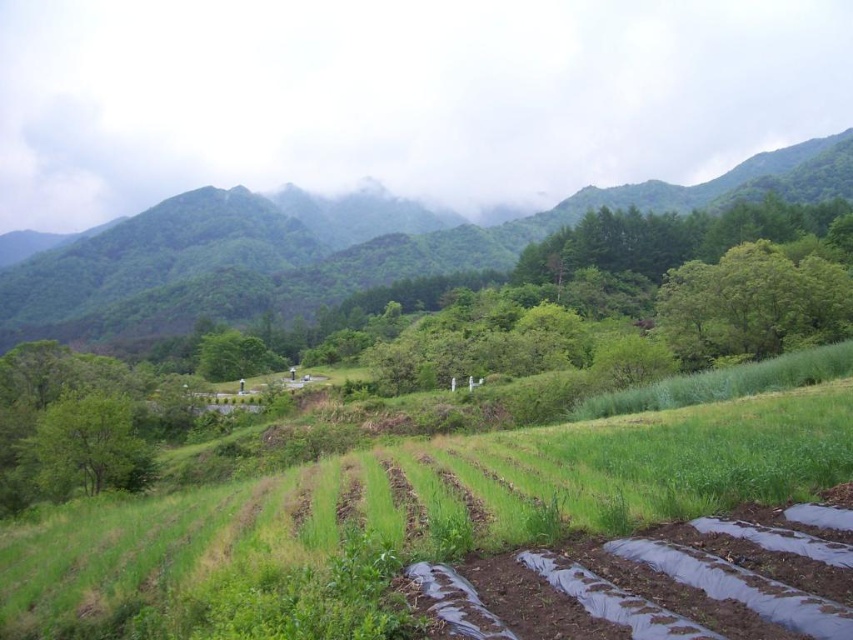
You are standing in the rural landscape and want to walk from the point closer to you to the point further away. Which path would you take between the two points, point 1 at (223, 273) and point 2 at (746, 352)?

You should walk from point 1 at (223, 273) to point 2 at (746, 352) because point 1 is closer to you and point 2 is further away, so the path goes from the closer to the farther point.

You are a landscape architect designing a hiking trail that must pass between the green grassy hillside at upper center and the green leafy tree at left. Based on the scene, which object will the trail need to go around due to its height?

The trail will need to go around the green grassy hillside at upper center because it has a greater height compared to the green leafy tree at left, making it an obstacle that requires a detour.

You are standing at the point labeled as point (428, 252) in the image. What do you see around you?

You are standing on the green grassy hillside at upper center, so around you would be the green grassy hillside at upper center and possibly other elements from the scene description like the cultivated field with rows of crops in the foreground and the midground with grassy areas and trees.